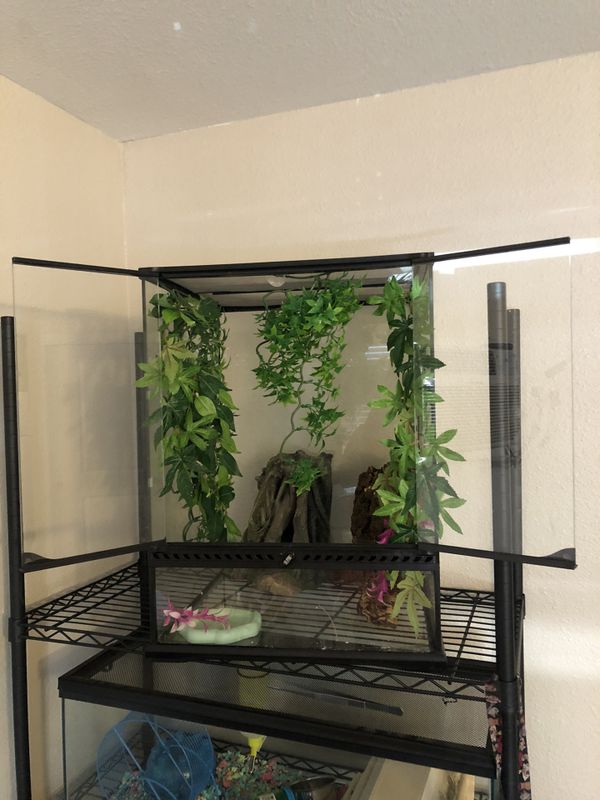
Identify the location of doors. This screenshot has width=600, height=800. (482, 426), (74, 400).